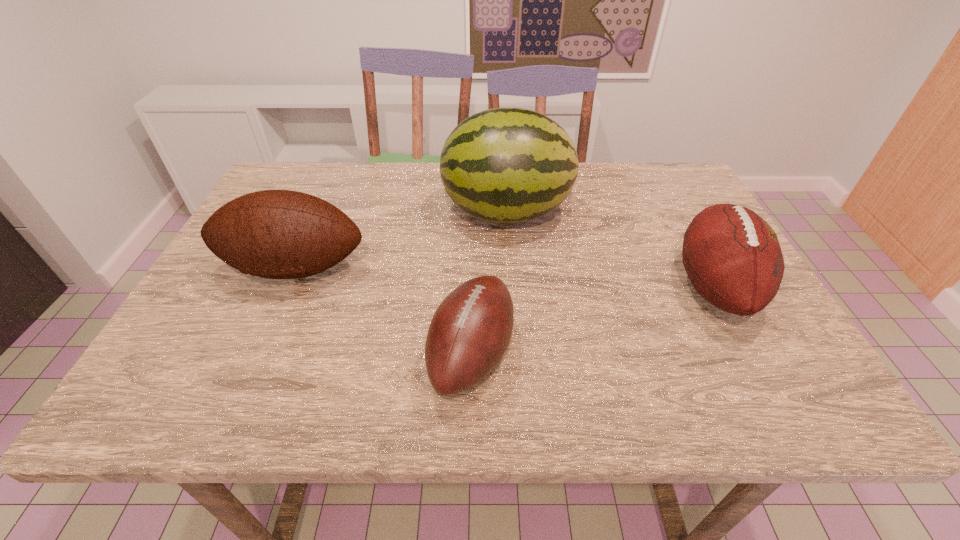
Where is `watermelon`? watermelon is located at coordinates (503, 165).

At what (x,y) coordinates should I click in order to perform the action: click on the leftmost object. Please return your answer as a coordinate pair (x, y). Looking at the image, I should click on (279, 234).

The height and width of the screenshot is (540, 960). What are the coordinates of `the rightmost object` in the screenshot? It's located at pos(732,256).

At what (x,y) coordinates should I click in order to perform the action: click on the shortest football (American). Please return your answer as a coordinate pair (x, y). Looking at the image, I should click on (470, 331).

You are a GUI agent. You are given a task and a screenshot of the screen. Output one action in this format:
    pyautogui.click(x=<x>, y=<y>)
    Task: Click on the shortest object
    This screenshot has width=960, height=540.
    Given the screenshot: What is the action you would take?
    pyautogui.click(x=470, y=331)

Identify the location of free space located at the stem end of the watermelon. [353, 212].

Identify the location of free location located 0.160m at the stem end of the watermelon. (383, 212).

This screenshot has width=960, height=540. Identify the location of vacant space located at the stem end of the watermelon. (346, 212).

You are a GUI agent. You are given a task and a screenshot of the screen. Output one action in this format:
    pyautogui.click(x=<x>, y=<y>)
    Task: Click on the free region located on the laces of the leftmost football (American)
    
    Given the screenshot: What is the action you would take?
    pyautogui.click(x=262, y=344)

Locate an element on the screen. The width and height of the screenshot is (960, 540). vacant point located 0.120m on the left of the rightmost football (American) is located at coordinates click(x=619, y=287).